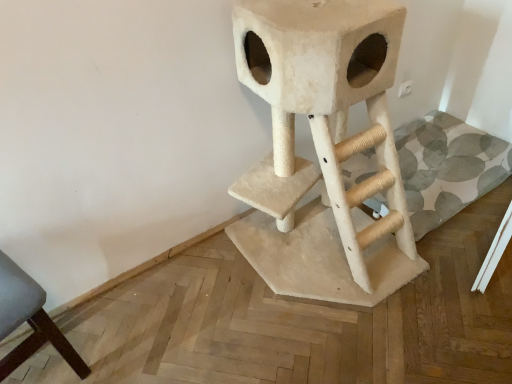
You are a GUI agent. You are given a task and a screenshot of the screen. Output one action in this format:
    pyautogui.click(x=<x>, y=<y>)
    Task: Click on the vacant area that lies to the right of dark gray fabric chair at lower left
    Image resolution: width=512 pixels, height=384 pixels.
    Given the screenshot: What is the action you would take?
    pyautogui.click(x=124, y=340)